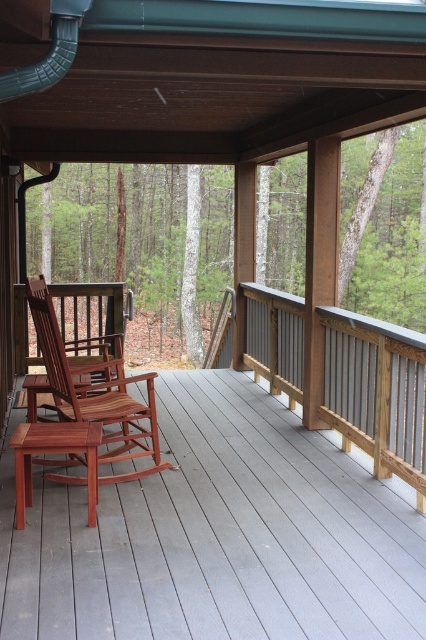
Can you confirm if gray wood rail at right is shorter than mahogany wood rocking chair at center?

Correct, gray wood rail at right is not as tall as mahogany wood rocking chair at center.

Between point (420, 481) and point (117, 397), which one is positioned behind?

Positioned behind is point (117, 397).

Find the location of a particular element. Image resolution: width=426 pixels, height=640 pixels. gray wood rail at right is located at coordinates (377, 392).

Who is lower down, smooth gray wood deck at center or mahogany wood rocking chair at center?

smooth gray wood deck at center

Consider the image. Does smooth gray wood deck at center have a smaller size compared to mahogany wood rocking chair at center?

No, smooth gray wood deck at center is not smaller than mahogany wood rocking chair at center.

The image size is (426, 640). What do you see at coordinates (218, 532) in the screenshot? I see `smooth gray wood deck at center` at bounding box center [218, 532].

Image resolution: width=426 pixels, height=640 pixels. Find the location of `smooth gray wood deck at center`. smooth gray wood deck at center is located at coordinates [x=218, y=532].

Measure the distance between point (22,621) and camera.

Point (22,621) and camera are 3.14 meters apart from each other.

Who is taller, smooth gray wood deck at center or gray wood rail at right?

Standing taller between the two is gray wood rail at right.

Describe the element at coordinates (218, 532) in the screenshot. I see `smooth gray wood deck at center` at that location.

Locate an element on the screen. smooth gray wood deck at center is located at coordinates (218, 532).